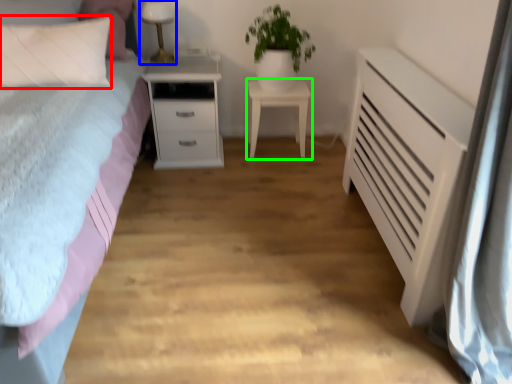
Question: Which object is positioned farthest from pillow (highlighted by a red box)? Select from table lamp (highlighted by a blue box) and nightstand (highlighted by a green box).

Choices:
 (A) table lamp
 (B) nightstand

Answer: (B)